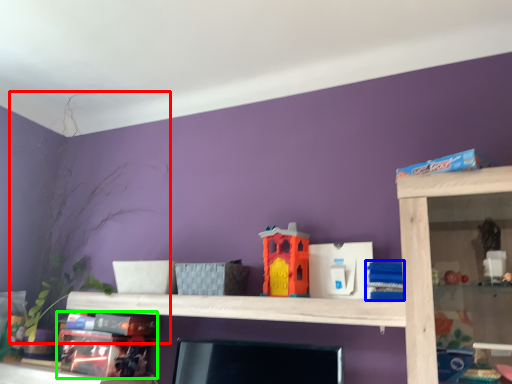
Question: Considering the real-world distances, which object is closest to plant (highlighted by a red box)? toy (highlighted by a blue box) or toy (highlighted by a green box).

Choices:
 (A) toy
 (B) toy

Answer: (B)